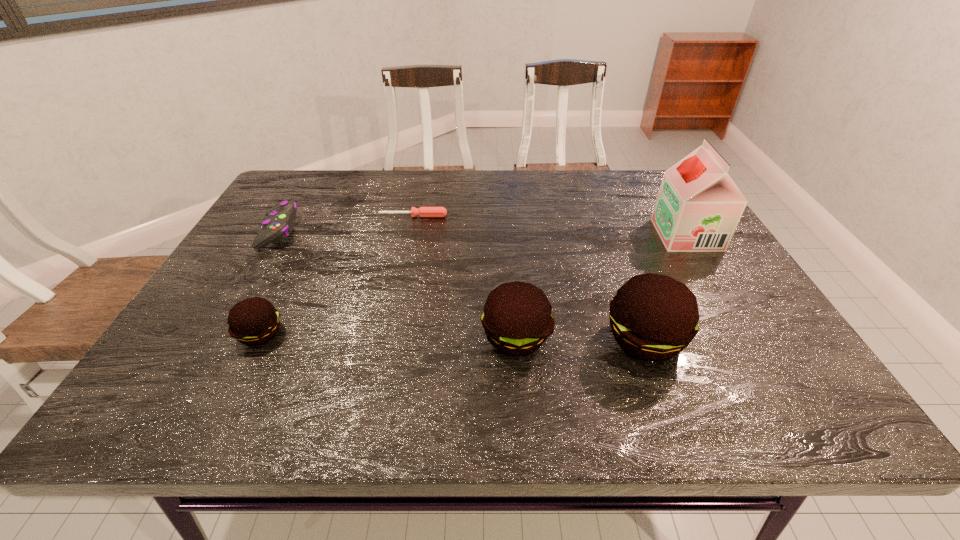
This screenshot has height=540, width=960. In order to click on vacant region between the fourth object from right to left and the fifth tallest object in this screenshot , I will do `click(346, 224)`.

Identify the location of empty space between the soya milk and the control. The height and width of the screenshot is (540, 960). (482, 233).

Identify the location of empty space between the third object from left to right and the second object from right to left. The height and width of the screenshot is (540, 960). (529, 277).

The image size is (960, 540). In order to click on free space between the fourth object from right to left and the second patty from right to left in this screenshot , I will do `click(465, 276)`.

I want to click on free space between the fourth shortest object and the screwdriver, so click(465, 276).

This screenshot has height=540, width=960. I want to click on free space between the third shortest object and the tallest object, so click(x=473, y=284).

Where is `free space between the fifth tallest object and the second patty from left to right`? Image resolution: width=960 pixels, height=540 pixels. free space between the fifth tallest object and the second patty from left to right is located at coordinates (396, 284).

The width and height of the screenshot is (960, 540). What are the coordinates of `free area in between the control and the third object from left to right` in the screenshot? It's located at (346, 224).

Where is `object that is the fifth closest one to the shortest object`? object that is the fifth closest one to the shortest object is located at coordinates (698, 208).

This screenshot has width=960, height=540. In order to click on the second closest object to the fifth object from left to right in this screenshot , I will do `click(698, 208)`.